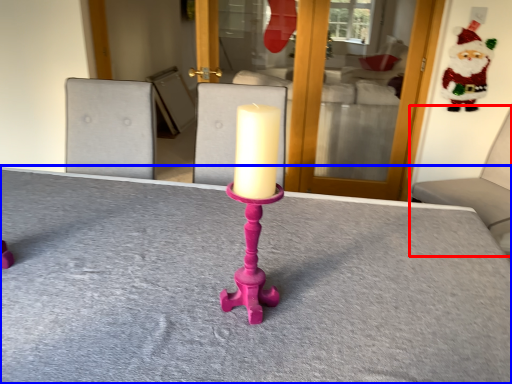
Question: Which point is further to the camera, furniture (highlighted by a red box) or table (highlighted by a blue box)?

Choices:
 (A) furniture
 (B) table

Answer: (A)